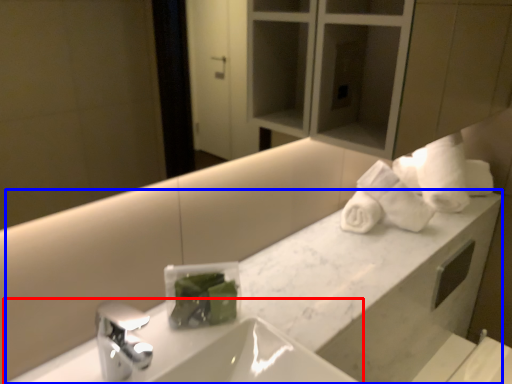
Question: Among these objects, which one is farthest to the camera, sink (highlighted by a red box) or counter (highlighted by a blue box)?

Choices:
 (A) sink
 (B) counter

Answer: (B)